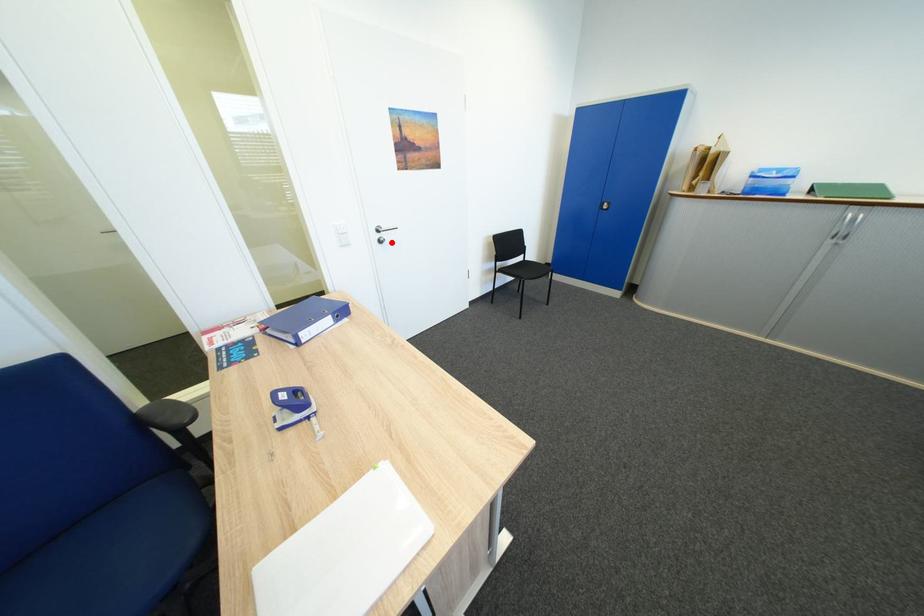
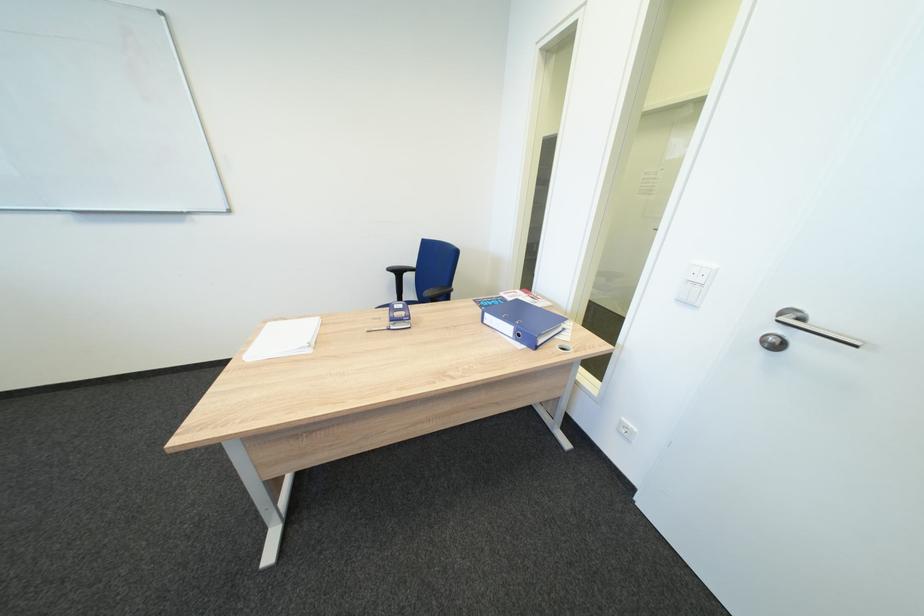
The point at the highlighted location is marked in the first image. Where is the corresponding point in the second image?

(784, 346)